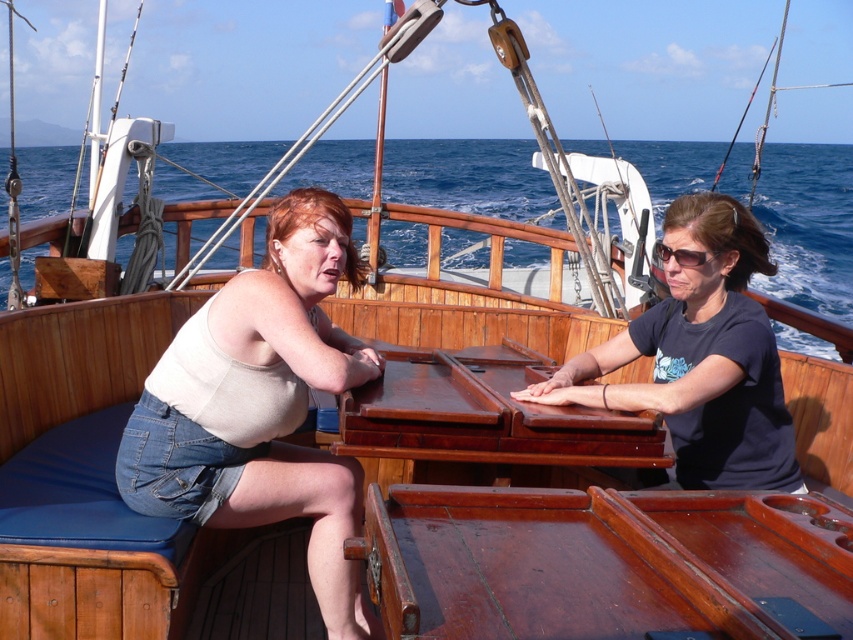
You are standing on the deck of the wooden sailing vessel and want to hand a map to the person wearing the matte beige tank top at left. If you can reach up to 2 meters, will you be able to reach them?

The matte beige tank top at left is 2.59 meters away from the camera, which is beyond your 2 meters reach. You cannot reach them directly and may need to move closer or use a tool.